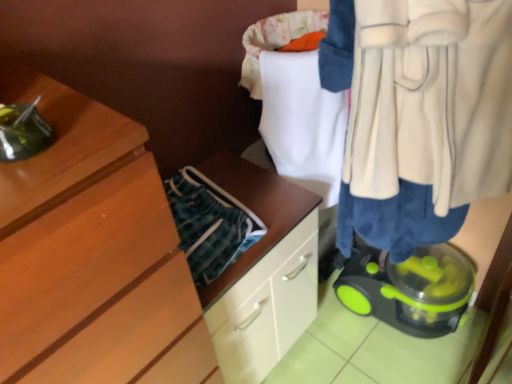
This screenshot has width=512, height=384. What do you see at coordinates (409, 289) in the screenshot?
I see `green plastic vacuum cleaner at lower right` at bounding box center [409, 289].

Find the location of a particular element. The width and height of the screenshot is (512, 384). green plastic vacuum cleaner at lower right is located at coordinates (409, 289).

Locate an element on the screen. This screenshot has width=512, height=384. green plastic vacuum cleaner at lower right is located at coordinates (409, 289).